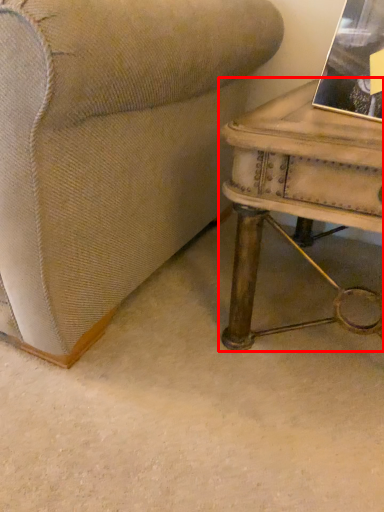
Question: From the image's perspective, what is the correct spatial relationship of table (annotated by the red box) in relation to book?

Choices:
 (A) below
 (B) above

Answer: (A)